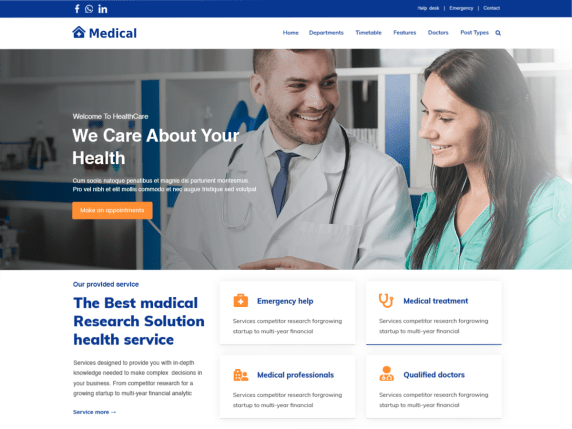
The height and width of the screenshot is (429, 572). Find the location of `shelf`. shelf is located at coordinates (54, 172).